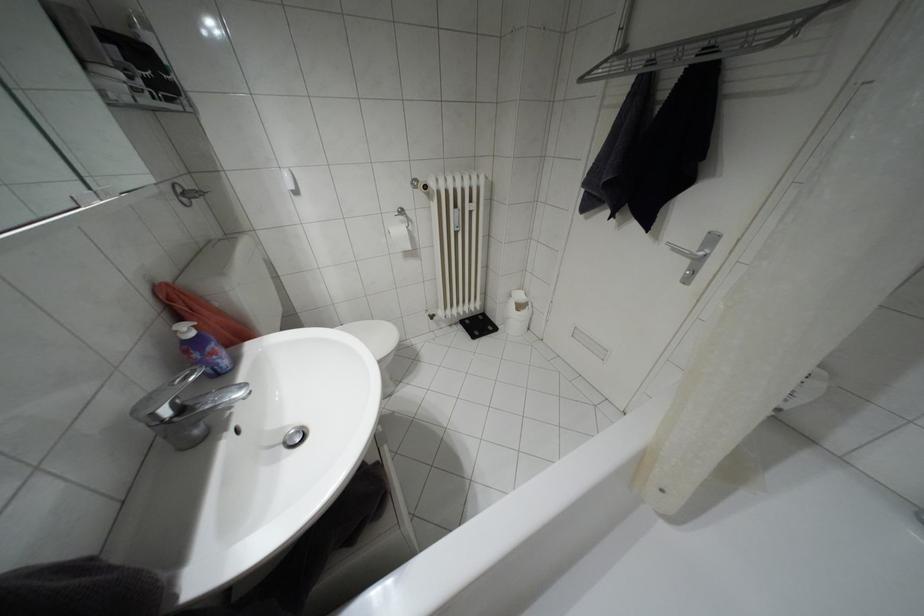
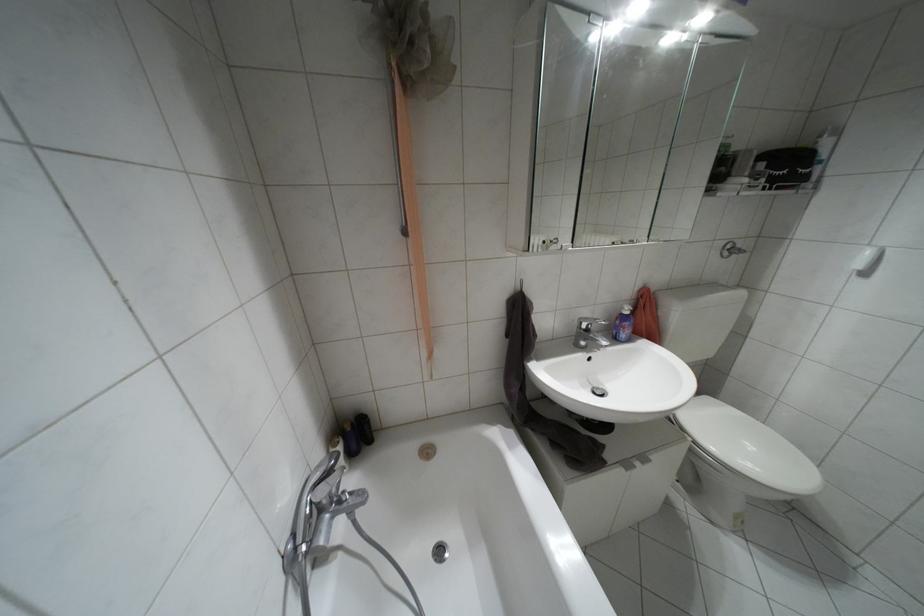
Where in the second image is the point corresponding to the point at 180,408 from the first image?

(587, 330)